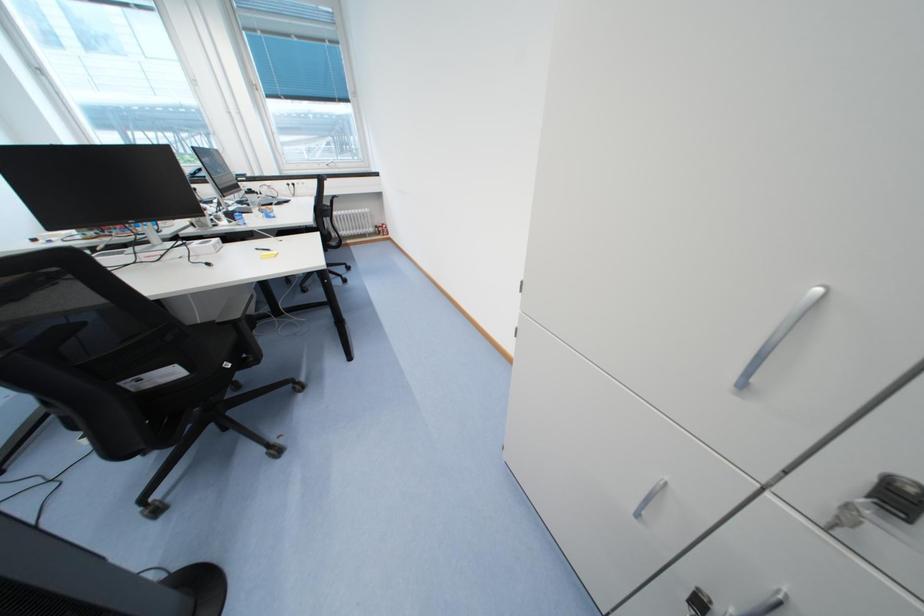
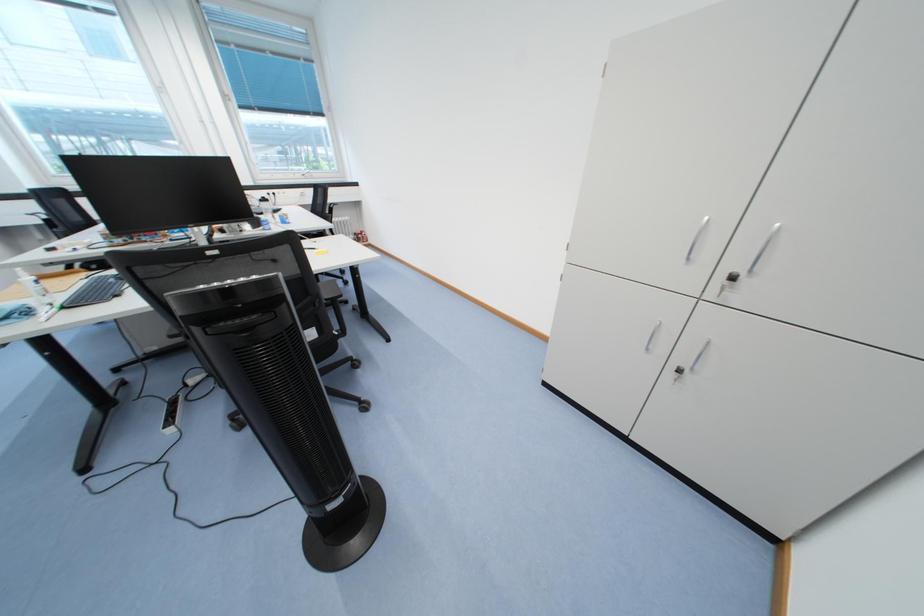
Question: How did the camera likely rotate?

Choices:
 (A) Left
 (B) Right
 (C) Up
 (D) Down

Answer: (B)